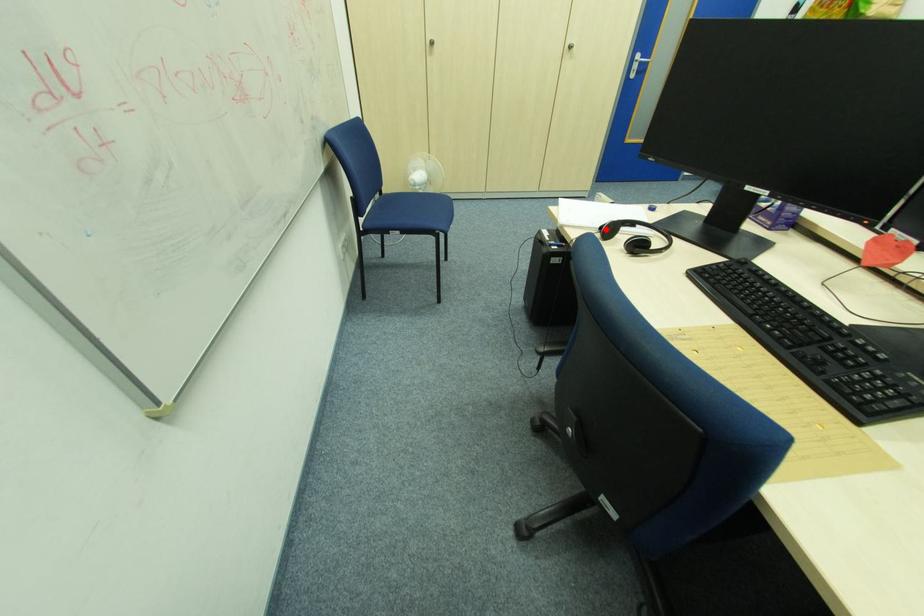
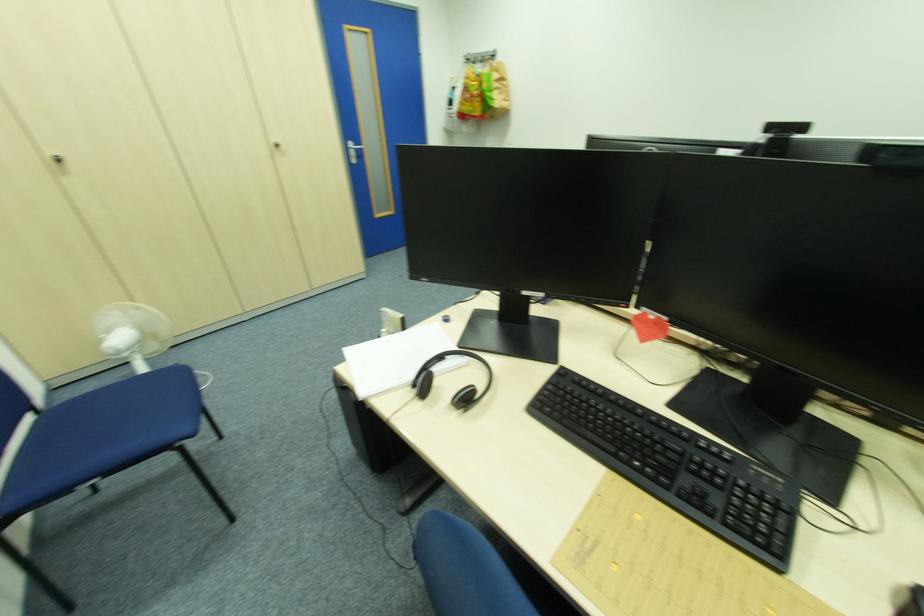
Locate, in the second image, the point that corresponds to the highlighted location in the first image.

(419, 387)